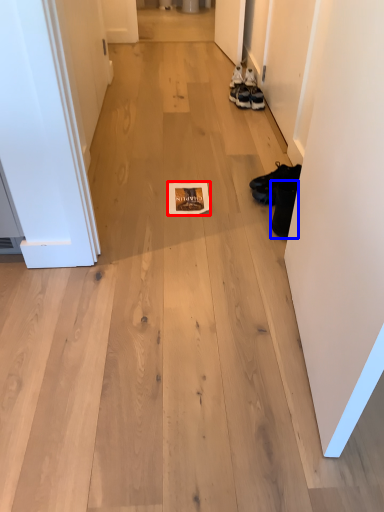
Question: Which object is closer to the camera taking this photo, magazine (highlighted by a red box) or footwear (highlighted by a blue box)?

Choices:
 (A) magazine
 (B) footwear

Answer: (B)